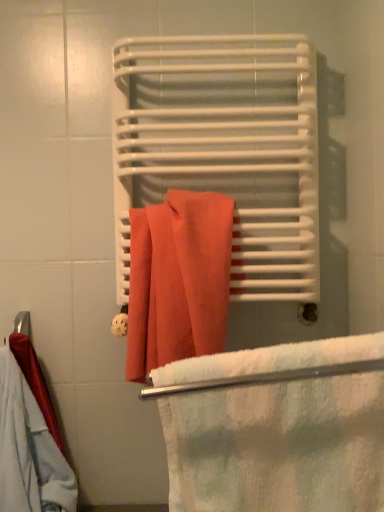
Question: Considering the relative positions of white soft towel at center and cotton towel at center in the image provided, is white soft towel at center to the left or to the right of cotton towel at center?

Choices:
 (A) left
 (B) right

Answer: (B)

Question: In terms of width, does white soft towel at center look wider or thinner when compared to cotton towel at center?

Choices:
 (A) wide
 (B) thin

Answer: (A)

Question: Which object is positioned closest to the matte orange towel at center?

Choices:
 (A) cotton towel at center
 (B) white soft towel at center

Answer: (A)

Question: Which object is the closest to the cotton towel at center?

Choices:
 (A) matte orange towel at center
 (B) white soft towel at center

Answer: (A)